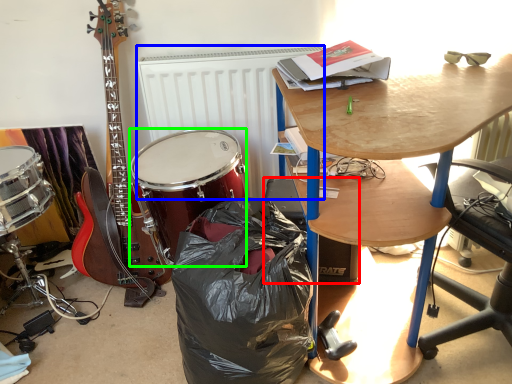
Question: Which object is positioned farthest from loudspeaker (highlighted by a red box)? Select from radiator (highlighted by a blue box) and drum (highlighted by a green box).

Choices:
 (A) radiator
 (B) drum

Answer: (A)